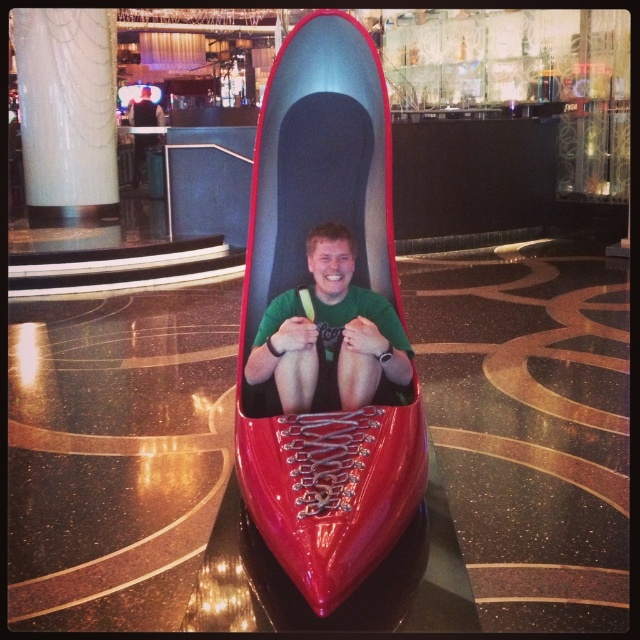
You are an interior designer planning to place a new sofa in a room. You have a glossy plastic shoe at center and a green matte shirt at center in the room. Which object takes up more space in the room?

The glossy plastic shoe at center is larger in size than the green matte shirt at center, so it takes up more space in the room.

You are a photographer trying to capture the glossy plastic shoe at center and the green matte shirt at center in a single frame. Which object should you focus on first to ensure both are in the frame without moving the camera?

You should focus on the glossy plastic shoe at center first because its width surpasses the green matte shirt at center, so centering the wider object ensures both fit within the frame.

You are an artist planning to paint a scene based on the image described. To ensure accuracy, you need to know the exact position of the glossy plastic shoe at center. What are the coordinates of its location?

The glossy plastic shoe at center is located at coordinates point (308,285).